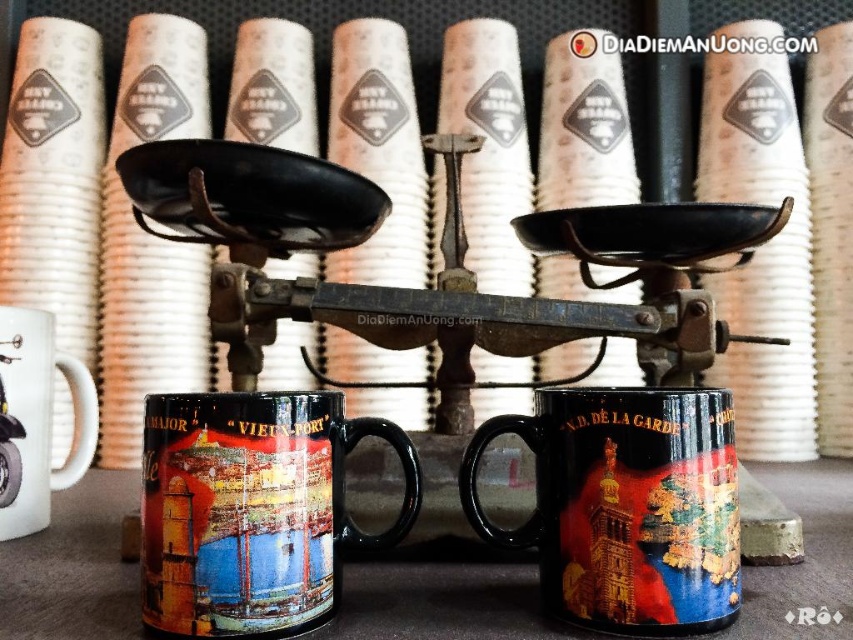
Question: Which of the following is the closest to the observer?

Choices:
 (A) (430, 577)
 (B) (514, 321)

Answer: (A)

Question: Which object is the closest to the black ceramic mug at center?

Choices:
 (A) white glossy mug at left
 (B) glossy ceramic mug at center
 (C) black matte table at center
 (D) black metal scale at center

Answer: (B)

Question: Which object appears farthest from the camera in this image?

Choices:
 (A) black ceramic mug at center
 (B) black metal scale at center
 (C) white glossy mug at left
 (D) black matte table at center

Answer: (C)

Question: Is black metal scale at center positioned in front of glossy ceramic mug at center?

Choices:
 (A) no
 (B) yes

Answer: (A)

Question: Can you confirm if glossy ceramic mug at center is positioned to the left of black matte table at center?

Choices:
 (A) yes
 (B) no

Answer: (A)

Question: Is glossy ceramic mug at center to the right of black ceramic mug at center from the viewer's perspective?

Choices:
 (A) yes
 (B) no

Answer: (B)